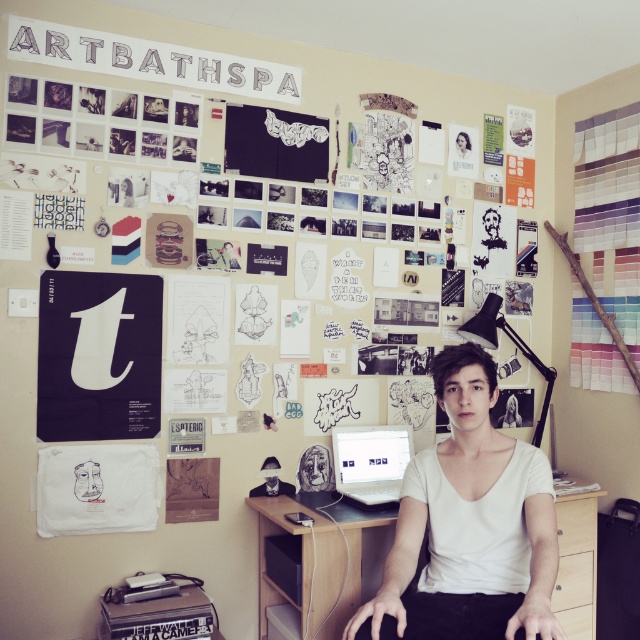
You are standing in the studio and see the point marked at coordinate (241, 234). What object is located at that point?

The matte black poster at upper center is located at point (241, 234).